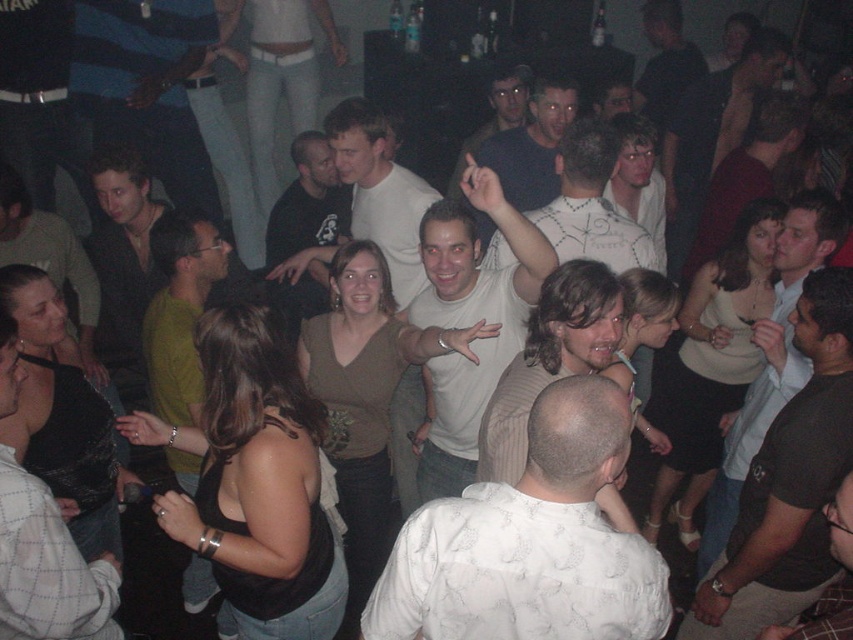
Question: Which point is farther to the camera?

Choices:
 (A) white dotted shirt at center
 (B) matte black shirt at upper left

Answer: (B)

Question: Among these objects, which one is farthest from the camera?

Choices:
 (A) matte black tank top at lower left
 (B) matte white shirt at center
 (C) matte black shirt at upper left

Answer: (B)

Question: Does white t-shirt at center lie behind matte black shirt at upper left?

Choices:
 (A) yes
 (B) no

Answer: (B)

Question: Is black fabric top at center wider than white dotted shirt at center?

Choices:
 (A) no
 (B) yes

Answer: (A)

Question: Observing the image, what is the correct spatial positioning of matte black shirt at upper left in reference to matte black tank top at lower left?

Choices:
 (A) below
 (B) above

Answer: (B)

Question: Which point is closer to the camera?

Choices:
 (A) white textured shirt at center
 (B) dark brown t-shirt at center
 (C) black fabric top at center
 (D) matte black tank top at lower left

Answer: (A)